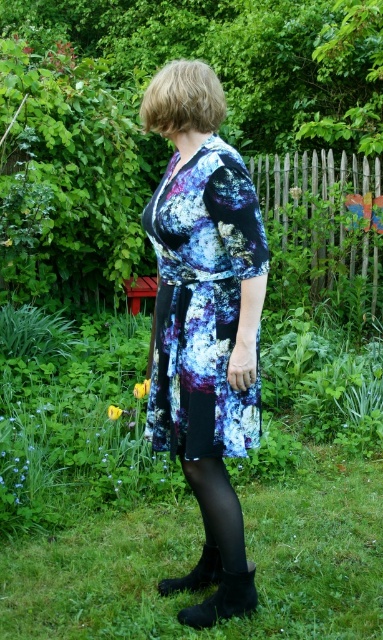
Question: Which of the following is the farthest from the observer?

Choices:
 (A) (x=163, y=593)
 (B) (x=214, y=618)
 (C) (x=9, y=557)
 (D) (x=322, y=163)

Answer: (D)

Question: Which of the following is the farthest from the observer?

Choices:
 (A) (198, 561)
 (B) (155, 352)

Answer: (A)

Question: Can you confirm if printed fabric dress at center is positioned below black suede boot at lower center?

Choices:
 (A) yes
 (B) no

Answer: (B)

Question: Considering the relative positions of green grass at lower center and printed fabric dress at center in the image provided, where is green grass at lower center located with respect to printed fabric dress at center?

Choices:
 (A) left
 (B) right

Answer: (A)

Question: Which object is the farthest from the wooden picket fence at upper right?

Choices:
 (A) black suede boot at lower center
 (B) black matte boot at lower center

Answer: (A)

Question: Is black suede boot at lower center behind black matte boot at lower center?

Choices:
 (A) no
 (B) yes

Answer: (A)